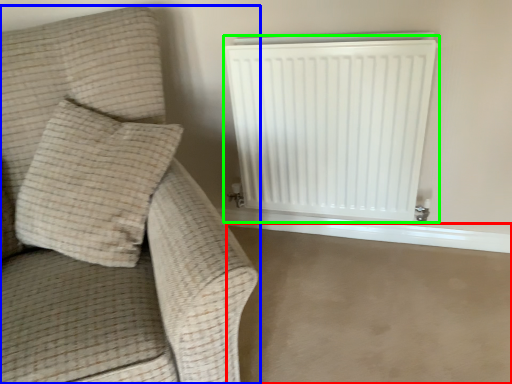
Question: Estimate the real-world distances between objects in this image. Which object is closer to concrete (highlighted by a red box), furniture (highlighted by a blue box) or radiator (highlighted by a green box)?

Choices:
 (A) furniture
 (B) radiator

Answer: (B)